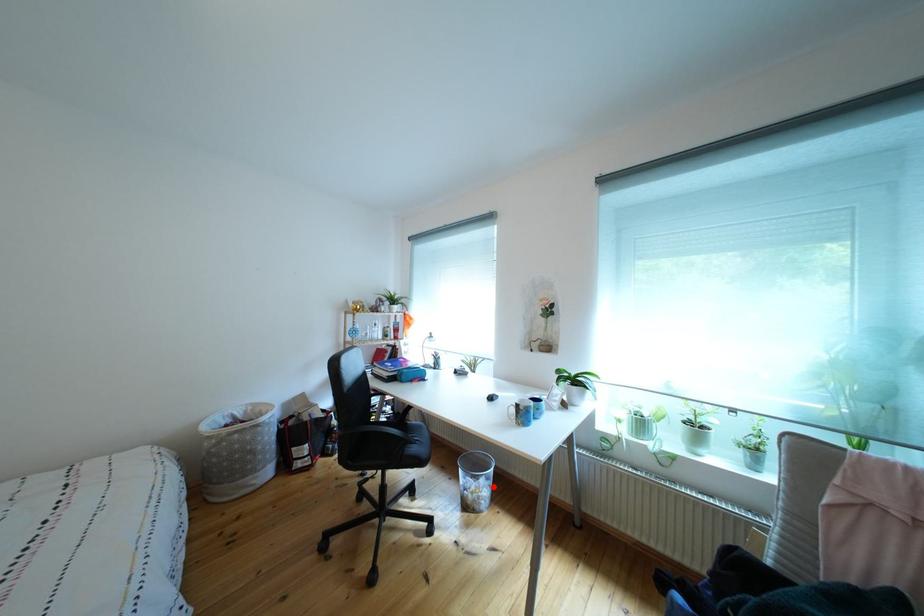
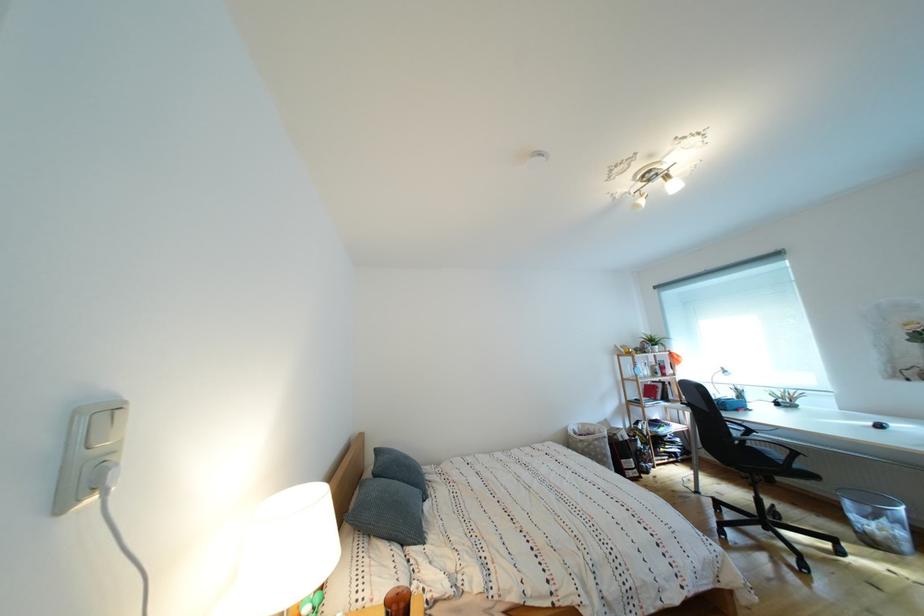
Question: I am providing you with two images of the same scene from different viewpoints. A red point is marked on the first image. Is the red point's position out of view in image 2?

Choices:
 (A) Yes
 (B) No

Answer: (B)